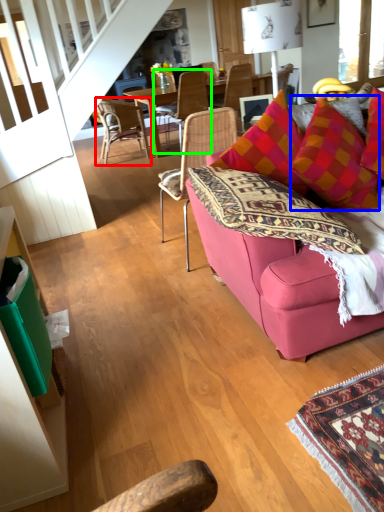
Question: Based on their relative distances, which object is nearer to chair (highlighted by a red box)? Choose from throw pillow (highlighted by a blue box) and chair (highlighted by a green box).

Choices:
 (A) throw pillow
 (B) chair

Answer: (B)